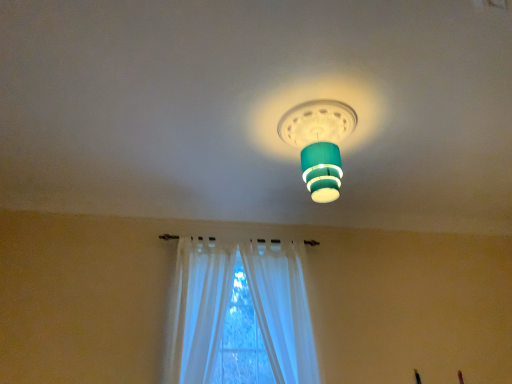
Question: Is white sheer curtain at center, which is counted as the first curtain, starting from the right, shorter than white sheer curtain at lower center, which ranks as the first curtain in left-to-right order?

Choices:
 (A) yes
 (B) no

Answer: (B)

Question: Is white sheer curtain at center, which is counted as the first curtain, starting from the right, placed right next to white sheer curtain at lower center, which ranks as the first curtain in left-to-right order?

Choices:
 (A) yes
 (B) no

Answer: (B)

Question: Considering the relative positions of white sheer curtain at center, which is counted as the first curtain, starting from the right, and white sheer curtain at lower center, which ranks as the first curtain in left-to-right order, in the image provided, is white sheer curtain at center, which is counted as the first curtain, starting from the right, to the left of white sheer curtain at lower center, which ranks as the first curtain in left-to-right order, from the viewer's perspective?

Choices:
 (A) no
 (B) yes

Answer: (A)

Question: Are white sheer curtain at center, which is counted as the first curtain, starting from the right, and white sheer curtain at lower center, the 2th curtain in the right-to-left sequence, located far from each other?

Choices:
 (A) yes
 (B) no

Answer: (B)

Question: From a real-world perspective, is white sheer curtain at center, which is the 2th curtain from left to right, located higher than white sheer curtain at lower center, the 2th curtain in the right-to-left sequence?

Choices:
 (A) yes
 (B) no

Answer: (B)

Question: From a real-world perspective, is white sheer curtain at center, which is counted as the first curtain, starting from the right, physically below white sheer curtain at lower center, which ranks as the first curtain in left-to-right order?

Choices:
 (A) yes
 (B) no

Answer: (A)

Question: Is white sheer curtain at lower center, which ranks as the first curtain in left-to-right order, completely or partially outside of teal matte lampshade at center?

Choices:
 (A) yes
 (B) no

Answer: (A)

Question: Is white sheer curtain at lower center, the 2th curtain in the right-to-left sequence, taller than teal matte lampshade at center?

Choices:
 (A) yes
 (B) no

Answer: (A)

Question: Is white sheer curtain at lower center, the 2th curtain in the right-to-left sequence, turned away from teal matte lampshade at center?

Choices:
 (A) yes
 (B) no

Answer: (B)

Question: Is white sheer curtain at lower center, the 2th curtain in the right-to-left sequence, far from teal matte lampshade at center?

Choices:
 (A) no
 (B) yes

Answer: (B)

Question: From a real-world perspective, is white sheer curtain at lower center, the 2th curtain in the right-to-left sequence, located beneath teal matte lampshade at center?

Choices:
 (A) no
 (B) yes

Answer: (B)

Question: Is white sheer curtain at lower center, which ranks as the first curtain in left-to-right order, facing towards teal matte lampshade at center?

Choices:
 (A) yes
 (B) no

Answer: (B)

Question: Is white sheer curtain at lower center, the 2th curtain in the right-to-left sequence, next to white sheer curtain at center, which is the 2th curtain from left to right, and touching it?

Choices:
 (A) yes
 (B) no

Answer: (B)